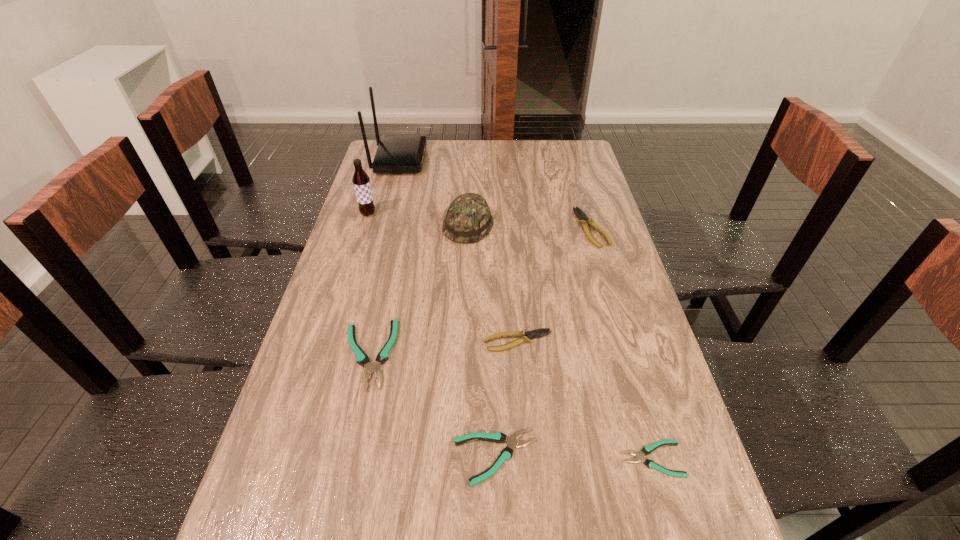
In order to click on the nearer yellow pliers in this screenshot , I will do `click(525, 336)`.

Where is `the seventh tallest object`? This screenshot has height=540, width=960. the seventh tallest object is located at coordinates (506, 454).

You are a GUI agent. You are given a task and a screenshot of the screen. Output one action in this format:
    pyautogui.click(x=<x>, y=<y>)
    Task: Click on the second smallest teal pliers
    
    Given the screenshot: What is the action you would take?
    pyautogui.click(x=506, y=454)

Find the location of `the smallest teal pliers`. the smallest teal pliers is located at coordinates (646, 450).

In order to click on the shortest pliers in this screenshot , I will do `click(646, 450)`.

In order to click on vacant region located on the front-facing side of the farthest object in this screenshot , I will do `click(453, 160)`.

The image size is (960, 540). In order to click on vacant region located 0.340m on the right of the root beer in this screenshot , I will do `click(478, 214)`.

At what (x,y) coordinates should I click in order to perform the action: click on vacant space situated 0.180m on the front of the sixth shortest object. Please return your answer as a coordinate pair (x, y). The height and width of the screenshot is (540, 960). Looking at the image, I should click on (467, 286).

Locate an element on the screen. This screenshot has width=960, height=540. vacant space situated on the left of the bigger yellow pliers is located at coordinates (549, 228).

Find the location of a particular element. This screenshot has height=540, width=960. blank space located 0.260m on the front of the biggest teal pliers is located at coordinates (331, 518).